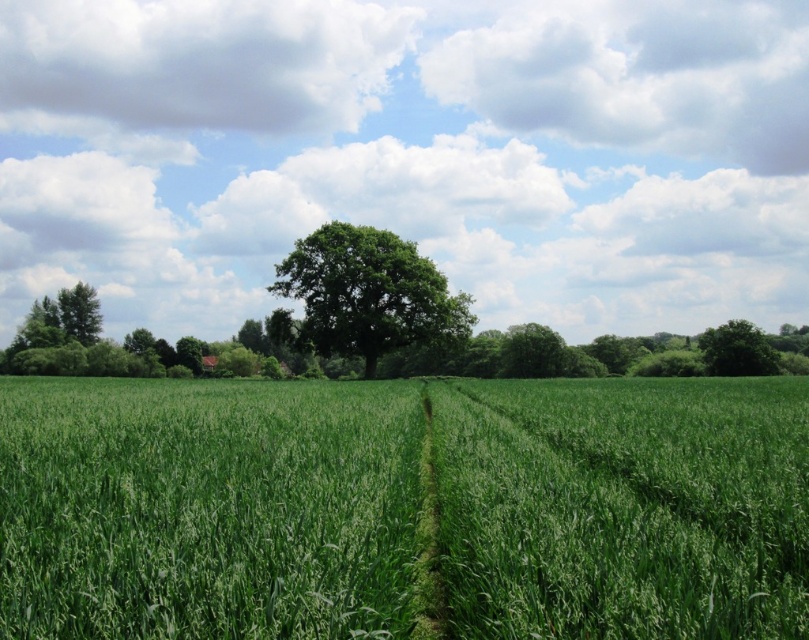
Question: Does green grassy wheat field at center have a larger size compared to green leafy tree at center?

Choices:
 (A) yes
 (B) no

Answer: (B)

Question: From the image, what is the correct spatial relationship of green grassy wheat field at center in relation to green leafy tree at right?

Choices:
 (A) above
 (B) below

Answer: (B)

Question: Is green grassy wheat field at center above green leafy tree at right?

Choices:
 (A) no
 (B) yes

Answer: (A)

Question: Which point is farther from the camera taking this photo?

Choices:
 (A) (701, 605)
 (B) (750, 358)

Answer: (B)

Question: Which point is closer to the camera?

Choices:
 (A) (380, 269)
 (B) (731, 369)

Answer: (A)

Question: Which object is farther from the camera taking this photo?

Choices:
 (A) green grassy wheat field at center
 (B) green leafy tree at center

Answer: (B)